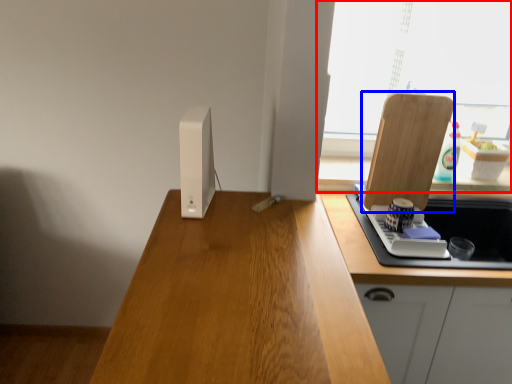
Question: Which object appears closest to the camera in this image, window (highlighted by a red box) or cutting board (highlighted by a blue box)?

Choices:
 (A) window
 (B) cutting board

Answer: (B)